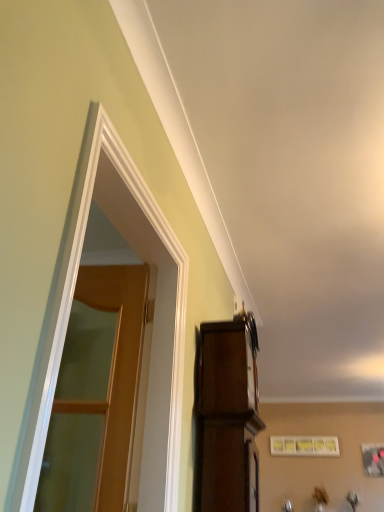
Question: Is matte white picture frame at upper center at the right side of wooden at left?

Choices:
 (A) yes
 (B) no

Answer: (A)

Question: Considering the relative sizes of matte white picture frame at upper center and wooden at left in the image provided, is matte white picture frame at upper center shorter than wooden at left?

Choices:
 (A) yes
 (B) no

Answer: (A)

Question: Can you confirm if matte white picture frame at upper center is positioned to the left of wooden at left?

Choices:
 (A) yes
 (B) no

Answer: (B)

Question: Does matte white picture frame at upper center have a greater width compared to wooden at left?

Choices:
 (A) no
 (B) yes

Answer: (B)

Question: Can you confirm if matte white picture frame at upper center is thinner than wooden at left?

Choices:
 (A) no
 (B) yes

Answer: (A)

Question: From the image's perspective, is wooden at left above or below matte white picture frame at upper center?

Choices:
 (A) above
 (B) below

Answer: (A)

Question: In terms of size, does wooden at left appear bigger or smaller than matte white picture frame at upper center?

Choices:
 (A) small
 (B) big

Answer: (A)

Question: Is wooden at left to the left or to the right of matte white picture frame at upper center in the image?

Choices:
 (A) right
 (B) left

Answer: (B)

Question: In the image, is wooden at left positioned in front of or behind matte white picture frame at upper center?

Choices:
 (A) front
 (B) behind

Answer: (A)

Question: From a real-world perspective, relative to wooden at left, is dark wood cabinet at upper right vertically above or below?

Choices:
 (A) below
 (B) above

Answer: (A)

Question: Based on their sizes in the image, would you say dark wood cabinet at upper right is bigger or smaller than wooden at left?

Choices:
 (A) small
 (B) big

Answer: (B)

Question: Is dark wood cabinet at upper right in front of or behind wooden at left in the image?

Choices:
 (A) front
 (B) behind

Answer: (B)

Question: Looking at their shapes, would you say dark wood cabinet at upper right is wider or thinner than wooden at left?

Choices:
 (A) thin
 (B) wide

Answer: (B)

Question: Is matte white picture frame at upper center in front of or behind wooden at left in the image?

Choices:
 (A) behind
 (B) front

Answer: (A)

Question: Is matte white picture frame at upper center situated inside wooden at left or outside?

Choices:
 (A) outside
 (B) inside

Answer: (A)